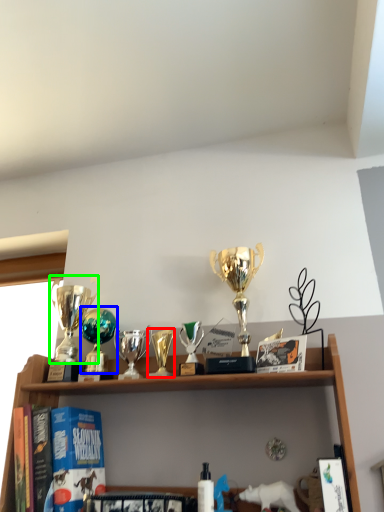
Question: Based on their relative distances, which object is nearer to candle holder (highlighted by a red box)? Choose from trophy (highlighted by a blue box) and trophy (highlighted by a green box).

Choices:
 (A) trophy
 (B) trophy

Answer: (A)